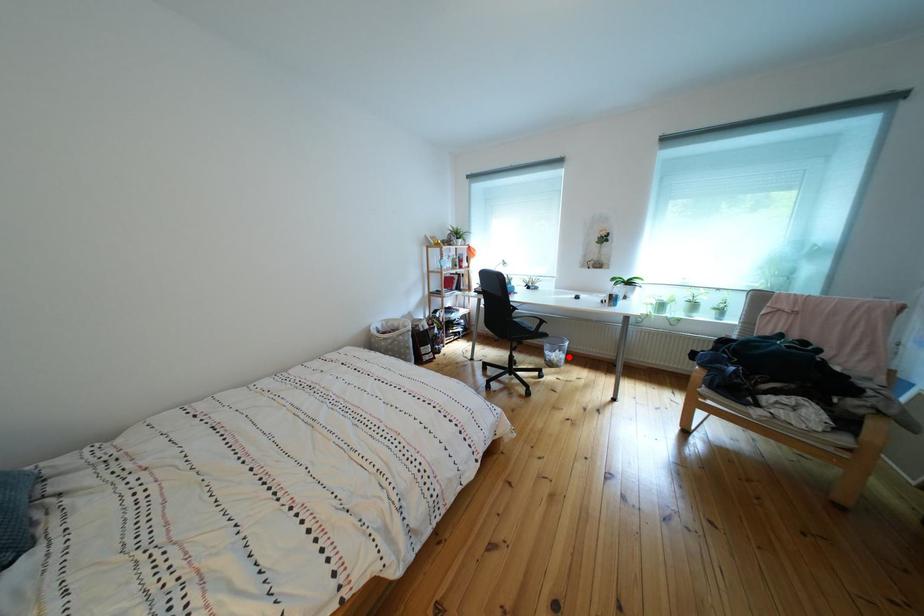
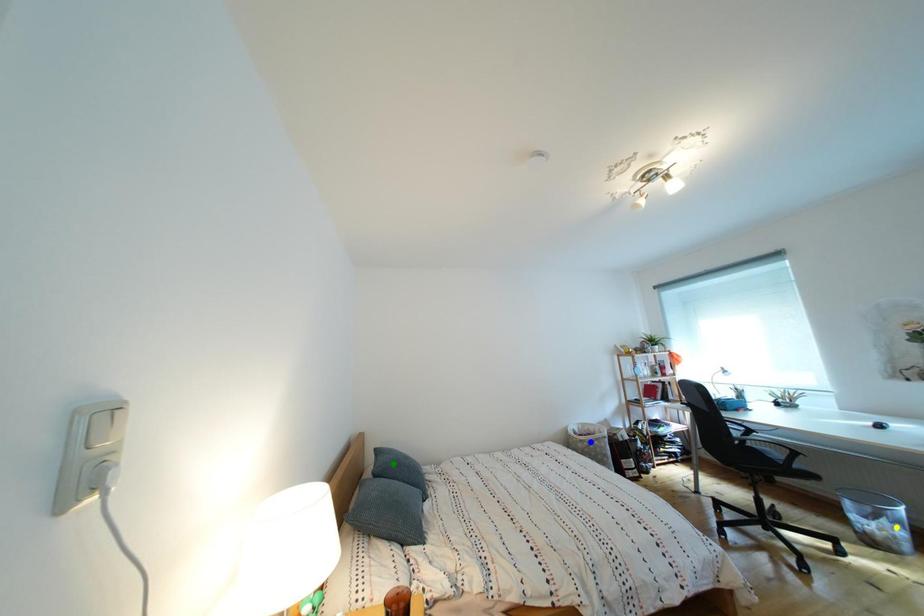
Question: I am providing you with two images of the same scene from different viewpoints. A red point is marked on the first image. You are given multiple points on the second image. Can you choose the point in image 2 that corresponds to the point in image 1?

Choices:
 (A) green point
 (B) yellow point
 (C) blue point

Answer: (B)